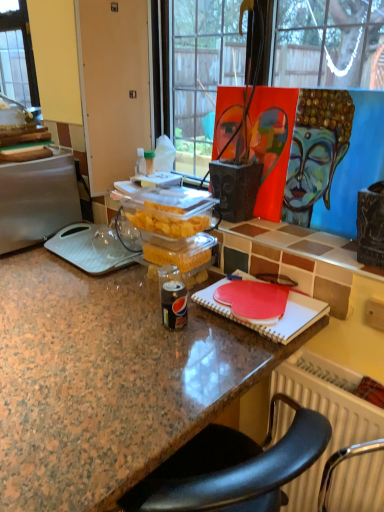
Question: Considering the positions of point (28, 243) and point (54, 436), is point (28, 243) closer or farther from the camera than point (54, 436)?

Choices:
 (A) farther
 (B) closer

Answer: (A)

Question: Considering the positions of silver metallic fridge at left and granite countertop at center in the image, is silver metallic fridge at left taller or shorter than granite countertop at center?

Choices:
 (A) tall
 (B) short

Answer: (B)

Question: Based on their relative distances, which object is nearer to the silver metallic fridge at left?

Choices:
 (A) painted canvas at upper right
 (B) granite countertop at center

Answer: (B)

Question: Which object is the farthest from the granite countertop at center?

Choices:
 (A) silver metallic fridge at left
 (B) painted canvas at upper right

Answer: (B)